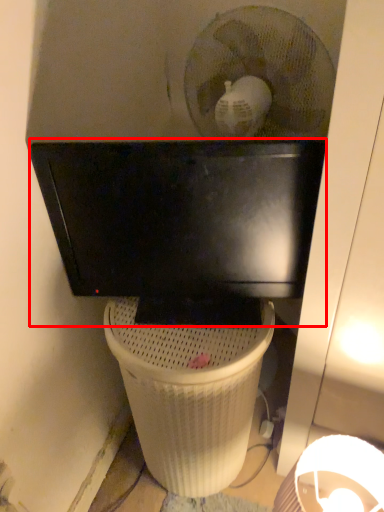
Question: From the image's perspective, considering the relative positions of computer monitor (annotated by the red box) and waste container in the image provided, where is computer monitor (annotated by the red box) located with respect to the staircase?

Choices:
 (A) below
 (B) above

Answer: (B)